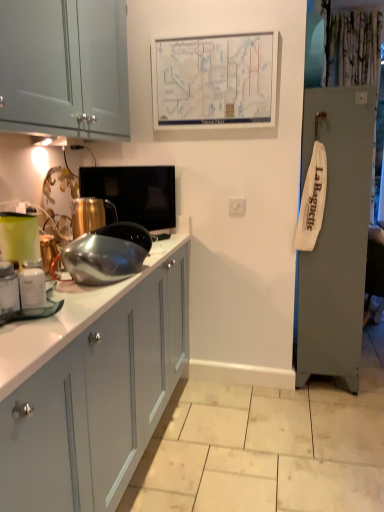
Describe the element at coordinates (32, 288) in the screenshot. I see `white glossy jar at left, the fourth appliance from the back` at that location.

In order to click on matte black tv at center, arranged as the fourth appliance when viewed from the front in this screenshot , I will do `click(134, 193)`.

The width and height of the screenshot is (384, 512). What do you see at coordinates (19, 237) in the screenshot?
I see `matte green plastic container at left` at bounding box center [19, 237].

Locate an element on the screen. The height and width of the screenshot is (512, 384). white paper map at upper center is located at coordinates (216, 80).

Would you consider matte green plastic container at left to be distant from white glossy jar at left, the fourth appliance from the back?

They are positioned close to each other.

Considering the relative sizes of matte green plastic container at left and white glossy jar at left, the first appliance from the front, in the image provided, is matte green plastic container at left bigger than white glossy jar at left, the first appliance from the front,?

Yes.

Considering the relative sizes of matte green plastic container at left and white glossy jar at left, the fourth appliance from the back, in the image provided, is matte green plastic container at left wider than white glossy jar at left, the fourth appliance from the back,?

Indeed, matte green plastic container at left has a greater width compared to white glossy jar at left, the fourth appliance from the back.

Is point (26, 251) closer to camera compared to point (37, 305)?

No, (26, 251) is behind (37, 305).

Could you tell me if matte white salt shaker at left is turned towards shiny metallic bowl at center, which is counted as the 2th appliance, starting from the front?

No, matte white salt shaker at left is not aimed at shiny metallic bowl at center, which is counted as the 2th appliance, starting from the front.

Which is more to the left, matte white salt shaker at left or shiny metallic bowl at center, which is counted as the 2th appliance, starting from the front?

Positioned to the left is matte white salt shaker at left.

In the image, is matte black tv at center, positioned as the 1th appliance in back-to-front order, positioned in front of or behind white paper map at upper center?

Visually, matte black tv at center, positioned as the 1th appliance in back-to-front order, is located in front of white paper map at upper center.

From a real-world perspective, relative to white paper map at upper center, is matte black tv at center, arranged as the fourth appliance when viewed from the front, vertically above or below?

matte black tv at center, arranged as the fourth appliance when viewed from the front, is situated lower than white paper map at upper center in the real world.

From the image's perspective, is matte black tv at center, positioned as the 1th appliance in back-to-front order, located beneath white paper map at upper center?

Yes, from the image's perspective, matte black tv at center, positioned as the 1th appliance in back-to-front order, is below white paper map at upper center.

Looking at their sizes, would you say matte black tv at center, arranged as the fourth appliance when viewed from the front, is wider or thinner than white paper map at upper center?

Considering their sizes, matte black tv at center, arranged as the fourth appliance when viewed from the front, looks broader than white paper map at upper center.

Considering their positions, is shiny metallic bowl at center, which is counted as the 2th appliance, starting from the front, located in front of or behind matte black tv at center, arranged as the fourth appliance when viewed from the front?

Visually, shiny metallic bowl at center, which is counted as the 2th appliance, starting from the front, is located in front of matte black tv at center, arranged as the fourth appliance when viewed from the front.

Is shiny metallic bowl at center, which is the third appliance from back to front, wider or thinner than matte black tv at center, arranged as the fourth appliance when viewed from the front?

Clearly, shiny metallic bowl at center, which is the third appliance from back to front, has more width compared to matte black tv at center, arranged as the fourth appliance when viewed from the front.

Is shiny metallic bowl at center, which is counted as the 2th appliance, starting from the front, bigger or smaller than matte black tv at center, positioned as the 1th appliance in back-to-front order?

shiny metallic bowl at center, which is counted as the 2th appliance, starting from the front, is bigger than matte black tv at center, positioned as the 1th appliance in back-to-front order.

Could you measure the distance between shiny metallic bowl at center, which is the third appliance from back to front, and matte black tv at center, arranged as the fourth appliance when viewed from the front?

shiny metallic bowl at center, which is the third appliance from back to front, and matte black tv at center, arranged as the fourth appliance when viewed from the front, are 22.48 inches apart from each other.

Is matte green plastic container at left oriented towards matte black tv at center, arranged as the fourth appliance when viewed from the front?

No, matte green plastic container at left is not aimed at matte black tv at center, arranged as the fourth appliance when viewed from the front.

Is matte green plastic container at left next to matte black tv at center, arranged as the fourth appliance when viewed from the front, and touching it?

No, matte green plastic container at left is not next to matte black tv at center, arranged as the fourth appliance when viewed from the front.

Is matte green plastic container at left taller than matte black tv at center, arranged as the fourth appliance when viewed from the front?

Incorrect, the height of matte green plastic container at left is not larger of that of matte black tv at center, arranged as the fourth appliance when viewed from the front.

How different are the orientations of matte green plastic container at left and matte black tv at center, arranged as the fourth appliance when viewed from the front, in degrees?

The facing directions of matte green plastic container at left and matte black tv at center, arranged as the fourth appliance when viewed from the front, are 34.9 degrees apart.

Between white glossy jar at left, the fourth appliance from the back, and white matte electric outlet at center, which one has less height?

Standing shorter between the two is white glossy jar at left, the fourth appliance from the back.

Relative to white matte electric outlet at center, is white glossy jar at left, the fourth appliance from the back, in front or behind?

white glossy jar at left, the fourth appliance from the back, is positioned closer to the viewer than white matte electric outlet at center.

Looking at this image, from a real-world perspective, who is located lower, white glossy jar at left, the fourth appliance from the back, or white matte electric outlet at center?

From a 3D spatial view, white glossy jar at left, the fourth appliance from the back, is below.

From the image's perspective, who appears lower, white glossy jar at left, the fourth appliance from the back, or white matte electric outlet at center?

From the image's view, white glossy jar at left, the fourth appliance from the back, is below.

From a real-world perspective, which is physically below, matte black tv at center, positioned as the 1th appliance in back-to-front order, or shiny metallic kettle at center-left, the 2th appliance when ordered from back to front?

shiny metallic kettle at center-left, the 2th appliance when ordered from back to front.

Does matte black tv at center, positioned as the 1th appliance in back-to-front order, come in front of shiny metallic kettle at center-left, the 3th appliance from the front?

That is False.

Which is correct: matte black tv at center, positioned as the 1th appliance in back-to-front order, is inside shiny metallic kettle at center-left, the 3th appliance from the front, or outside of it?

matte black tv at center, positioned as the 1th appliance in back-to-front order, is not inside shiny metallic kettle at center-left, the 3th appliance from the front, it's outside.

This screenshot has height=512, width=384. In order to click on the 2nd appliance counting from the right side of the matte green plastic container at left in this screenshot , I will do `click(32, 288)`.

I want to click on kitchen appliance below the shiny metallic bowl at center, which is the third appliance from back to front (from a real-world perspective), so 8,288.

Based on their spatial positions, is white glossy jar at left, the fourth appliance from the back, or shiny metallic kettle at center-left, the 3th appliance from the front, further from white paper map at upper center?

white glossy jar at left, the fourth appliance from the back, lies further to white paper map at upper center than the other object.

When comparing their distances from matte green plastic container at left, does white matte electric outlet at center or shiny metallic kettle at center-left, the 2th appliance when ordered from back to front, seem further?

The object further to matte green plastic container at left is white matte electric outlet at center.

Looking at the image, which one is located closer to white matte electric outlet at center, matte green plastic container at left or white paper map at upper center?

Among the two, white paper map at upper center is located nearer to white matte electric outlet at center.

Estimate the real-world distances between objects in this image. Which object is further from white matte electric outlet at center, matte white salt shaker at left or shiny metallic kettle at center-left, the 2th appliance when ordered from back to front?

matte white salt shaker at left.

Based on the photo, estimate the real-world distances between objects in this image. Which object is further from matte black tv at center, positioned as the 1th appliance in back-to-front order, white glossy jar at left, the fourth appliance from the back, or shiny metallic bowl at center, which is counted as the 2th appliance, starting from the front?

white glossy jar at left, the fourth appliance from the back.

Estimate the real-world distances between objects in this image. Which object is closer to white matte electric outlet at center, shiny metallic bowl at center, which is the third appliance from back to front, or matte green plastic container at left?

shiny metallic bowl at center, which is the third appliance from back to front.

Based on their spatial positions, is matte green plastic container at left or white matte electric outlet at center closer to white glossy jar at left, the fourth appliance from the back?

Among the two, matte green plastic container at left is located nearer to white glossy jar at left, the fourth appliance from the back.

Estimate the real-world distances between objects in this image. Which object is further from shiny metallic kettle at center-left, the 2th appliance when ordered from back to front, white matte electric outlet at center or shiny metallic bowl at center, which is the third appliance from back to front?

white matte electric outlet at center lies further to shiny metallic kettle at center-left, the 2th appliance when ordered from back to front, than the other object.

Locate an element on the screen. This screenshot has width=384, height=512. home appliance between white paper map at upper center and white glossy jar at left, the fourth appliance from the back, from top to bottom is located at coordinates (19, 237).

Find the location of a particular element. home appliance between white glossy jar at left, the fourth appliance from the back, and white matte electric outlet at center from front to back is located at coordinates (19, 237).

Image resolution: width=384 pixels, height=512 pixels. Find the location of `appliance between matte white salt shaker at left and shiny metallic bowl at center, which is the third appliance from back to front, from front to back`. appliance between matte white salt shaker at left and shiny metallic bowl at center, which is the third appliance from back to front, from front to back is located at coordinates (32, 288).

Locate an element on the screen. electric outlet between white paper map at upper center and shiny metallic kettle at center-left, the 3th appliance from the front, vertically is located at coordinates (237, 206).